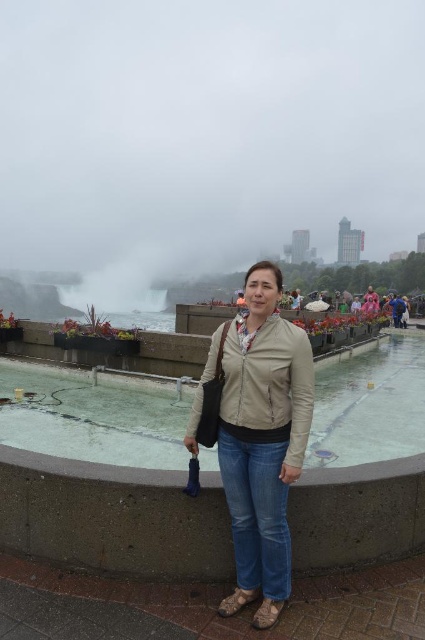
Question: Which point is farther to the camera?

Choices:
 (A) beige leather jacket at center
 (B) clear glass water at center

Answer: (B)

Question: Which object appears closest to the camera in this image?

Choices:
 (A) beige leather jacket at center
 (B) clear glass water at center

Answer: (A)

Question: Does clear glass water at center come in front of beige leather jacket at center?

Choices:
 (A) yes
 (B) no

Answer: (B)

Question: Is clear glass water at center behind beige leather jacket at center?

Choices:
 (A) no
 (B) yes

Answer: (B)

Question: Can you confirm if clear glass water at center is positioned to the right of beige leather jacket at center?

Choices:
 (A) no
 (B) yes

Answer: (B)